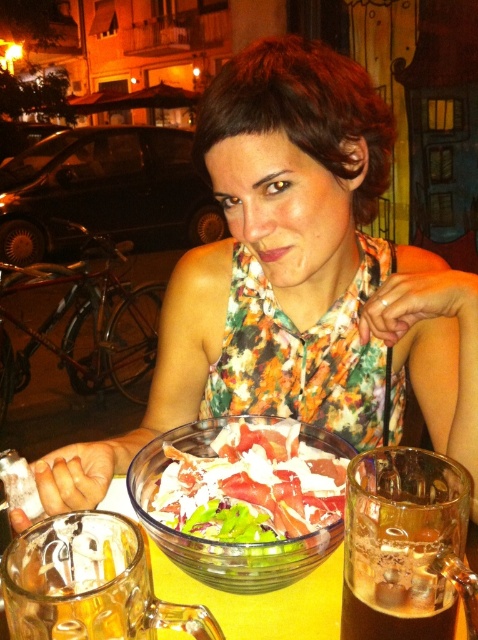
You are standing at the edge of the table in the image. You want to reach the point closer to you between the two points labeled point (417, 627) and point (150, 502). Which point should you aim for?

Point (417, 627) is closer to the viewer than point (150, 502), so you should aim for point (417, 627).